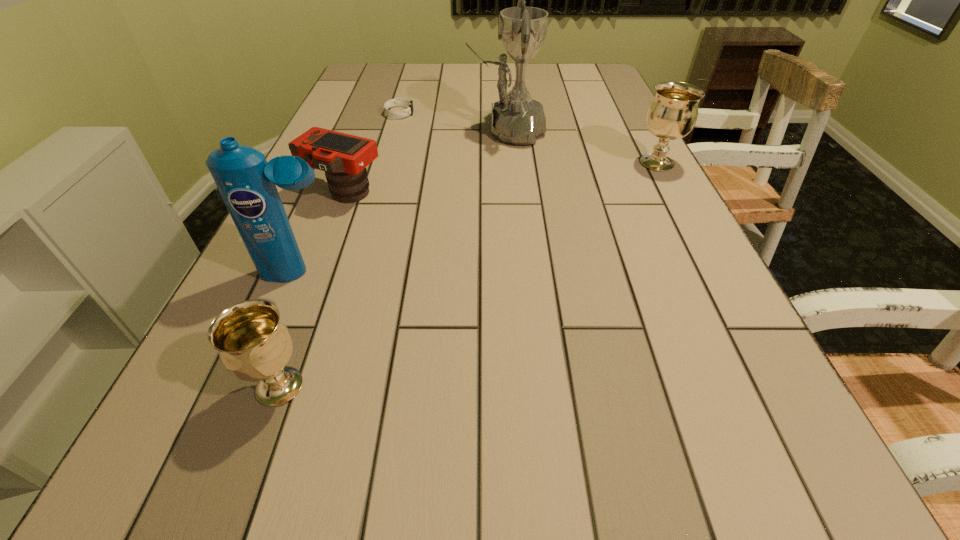
This screenshot has height=540, width=960. I want to click on vacant space located on the left of the taller chalice, so click(554, 163).

Locate an element on the screen. vacant position located 0.110m on the front of the camera is located at coordinates (324, 243).

Locate an element on the screen. The width and height of the screenshot is (960, 540). vacant space located 0.180m on the side with emblem of the award is located at coordinates (404, 131).

The image size is (960, 540). In order to click on vacant space positioned on the side with emblem of the award in this screenshot , I will do `click(408, 131)`.

The width and height of the screenshot is (960, 540). I want to click on free location located on the side with emblem of the award, so click(404, 131).

What are the coordinates of `vacant area situated 0.320m on the outer surface of the wristband` in the screenshot? It's located at (518, 113).

Locate an element on the screen. The image size is (960, 540). free space located on the back of the second nearest object is located at coordinates (319, 230).

The width and height of the screenshot is (960, 540). Identify the location of object at the near edge. (254, 344).

The width and height of the screenshot is (960, 540). I want to click on chalice positioned at the left edge, so click(254, 344).

You are a GUI agent. You are given a task and a screenshot of the screen. Output one action in this format:
    pyautogui.click(x=<x>, y=<y>)
    Task: Click on the camera that is at the left edge
    The height and width of the screenshot is (540, 960).
    Given the screenshot: What is the action you would take?
    pyautogui.click(x=344, y=157)